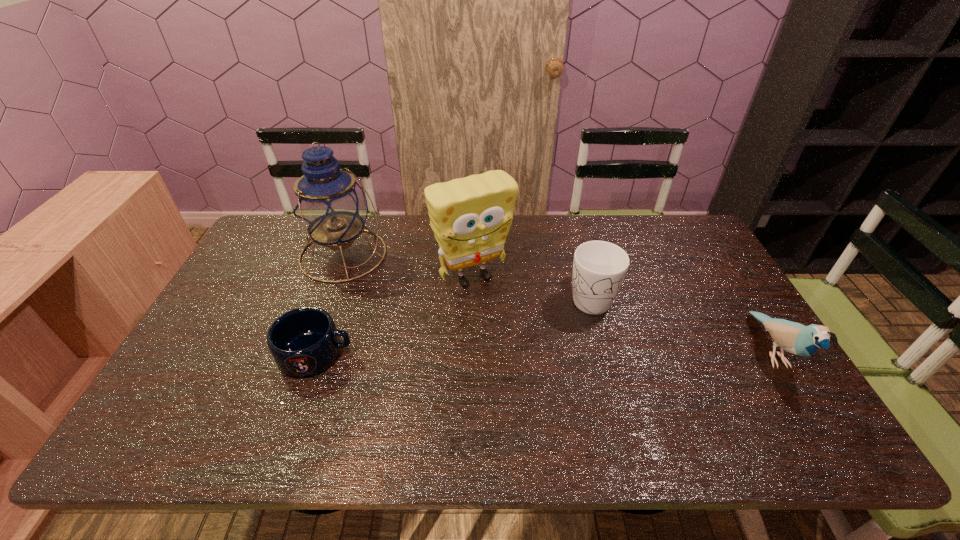
Identify the location of bird that is positioned at the near edge. (795, 338).

Locate an element on the screen. The width and height of the screenshot is (960, 540). object situated at the right edge is located at coordinates (795, 338).

Where is `object that is at the near right corner`? The image size is (960, 540). object that is at the near right corner is located at coordinates (795, 338).

Identify the location of free space at the far edge. The image size is (960, 540). click(615, 217).

Find the location of `free space at the near edge of the desktop`. free space at the near edge of the desktop is located at coordinates (412, 402).

This screenshot has width=960, height=540. In the image, there is a desktop. What are the coordinates of `vacant space at the left edge` in the screenshot? It's located at [238, 309].

The image size is (960, 540). Find the location of `vacant space at the right edge`. vacant space at the right edge is located at coordinates (725, 302).

You are a GUI agent. You are given a task and a screenshot of the screen. Output one action in this format:
    pyautogui.click(x=<x>, y=<y>)
    Task: Click on the vacant space at the far left corner
    
    Given the screenshot: What is the action you would take?
    pyautogui.click(x=293, y=237)

You are a GUI agent. You are given a task and a screenshot of the screen. Output one action in this format:
    pyautogui.click(x=<x>, y=<y>)
    Task: Click on the empty space that is in between the lantern and the taller mug
    
    Given the screenshot: What is the action you would take?
    tap(467, 275)

The image size is (960, 540). Identify the location of unoccupied position between the bird and the fourth shortest object. (622, 314).